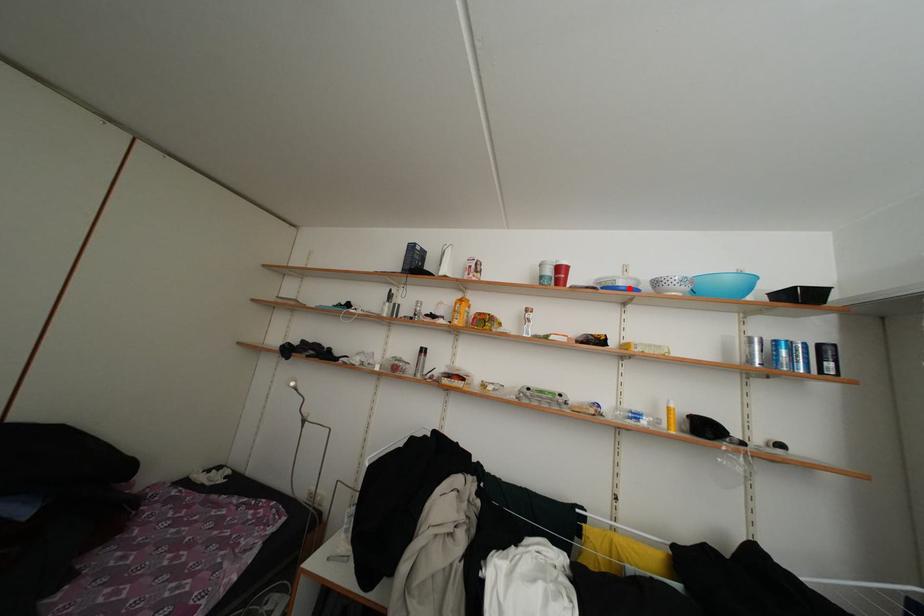
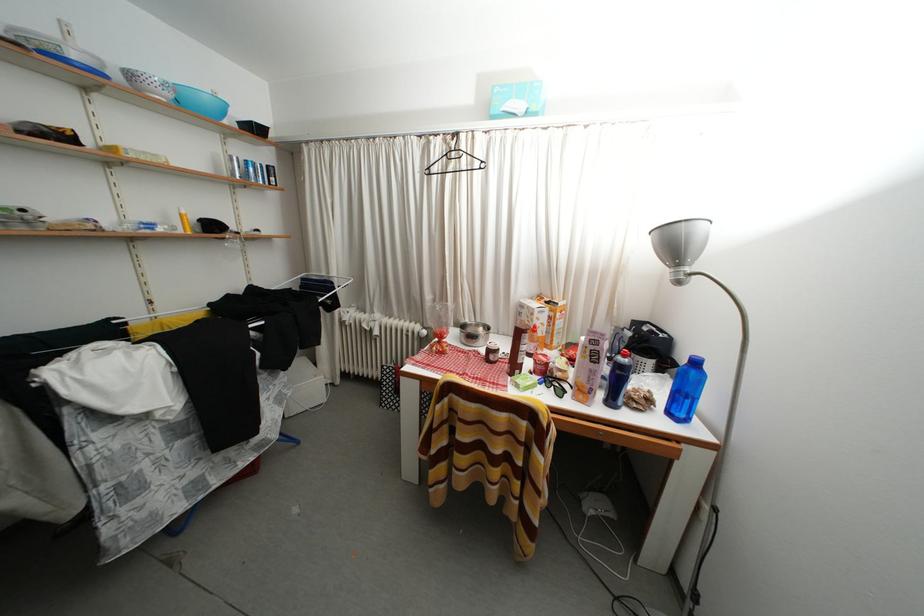
Find the pixel in the second image that matches the highlighted location in the first image.

(81, 61)